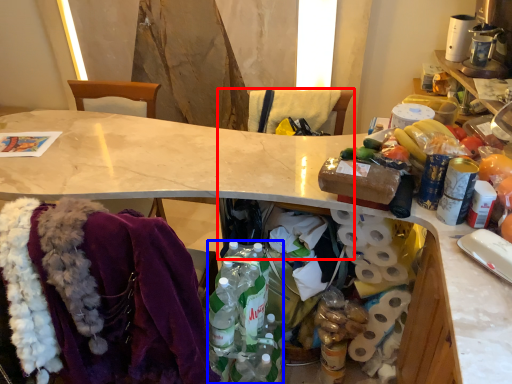
Question: Among these objects, which one is farthest to the camera, chair (highlighted by a red box) or bottle (highlighted by a blue box)?

Choices:
 (A) chair
 (B) bottle

Answer: (B)